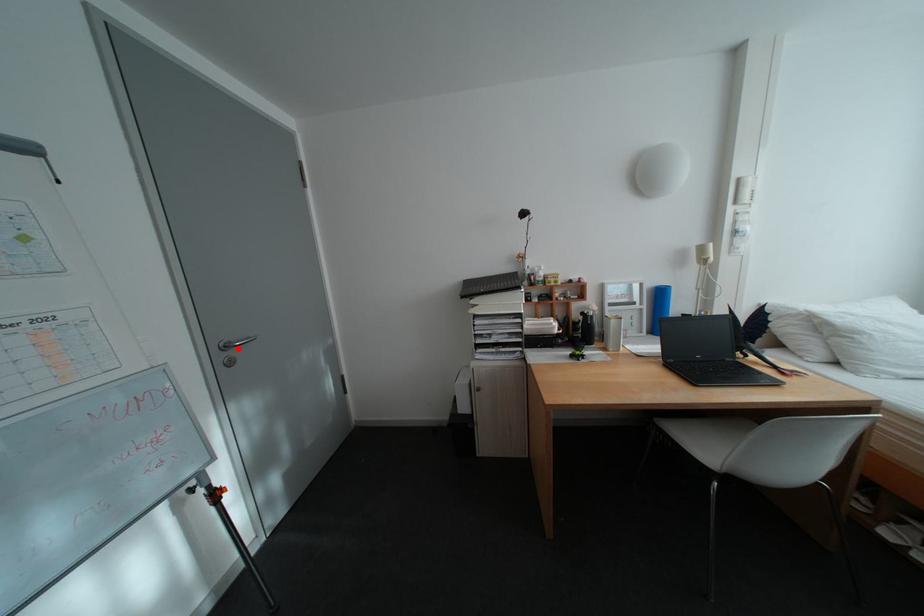
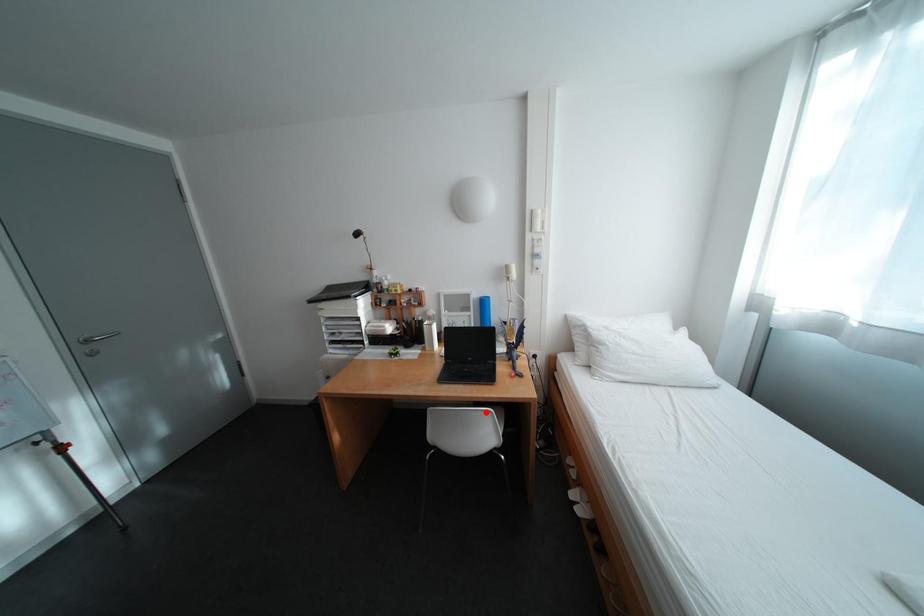
I am providing you with two images of the same scene from different viewpoints. A red point is marked on the first image and another point is marked on the second image. Is the marked point in image1 the same physical position as the marked point in image2?

No